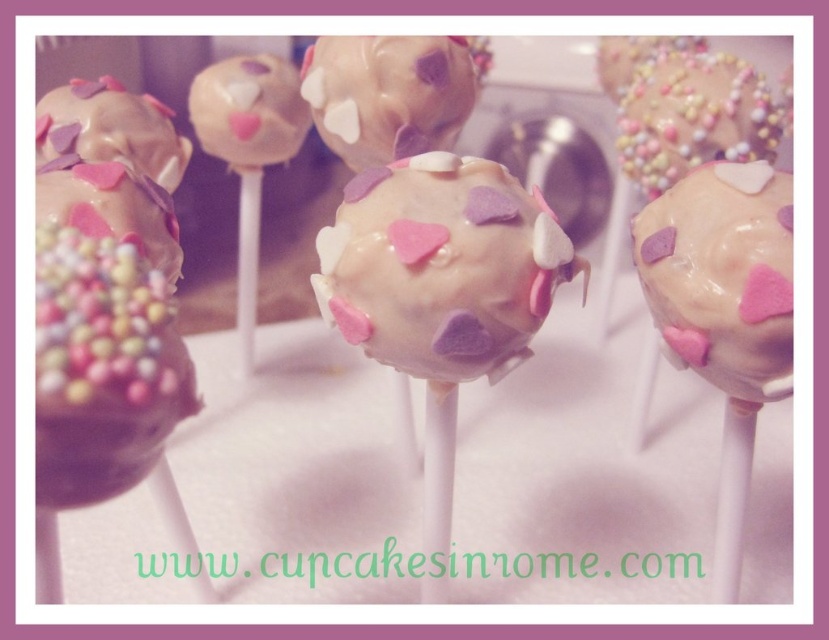
Question: Does white glossy cake pop at center have a smaller size compared to chocolate-coated cake pop at left?

Choices:
 (A) yes
 (B) no

Answer: (B)

Question: Which object is farther from the camera taking this photo?

Choices:
 (A) chocolate-coated cake pop at left
 (B) white chocolate cake pop at center

Answer: (B)

Question: Can you confirm if chocolate-coated cake pop at left is positioned to the left of matte white cake pop at center?

Choices:
 (A) yes
 (B) no

Answer: (B)

Question: Which of these objects is positioned farthest from the white glossy cake pop at center?

Choices:
 (A) pastel sprinkled cake pop at center
 (B) matte white cake pop at center
 (C) white chocolate cake pop at center

Answer: (B)

Question: Estimate the real-world distances between objects in this image. Which object is closer to the white glossy cake pop at right?

Choices:
 (A) chocolate-coated cake pop at left
 (B) matte chocolate cake pop at upper left

Answer: (A)

Question: Can you confirm if pastel sprinkled cake pop at center is positioned above matte white cake pop at center?

Choices:
 (A) no
 (B) yes

Answer: (B)